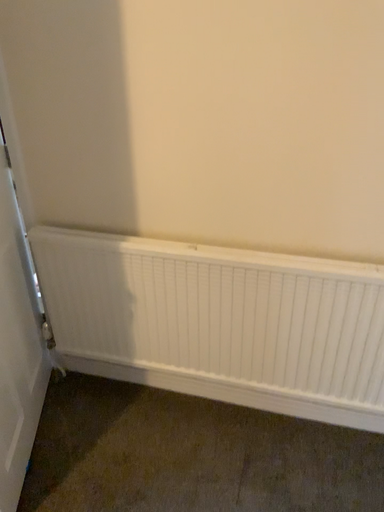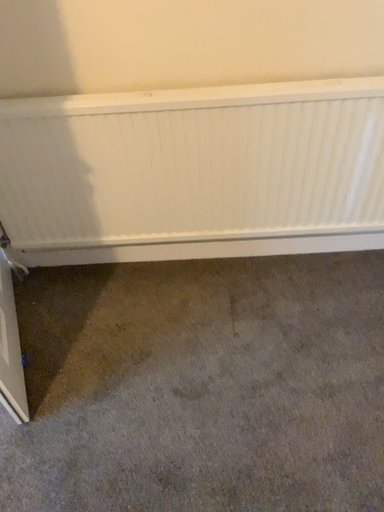
Question: Which way did the camera rotate in the video?

Choices:
 (A) rotated right
 (B) rotated left

Answer: (A)